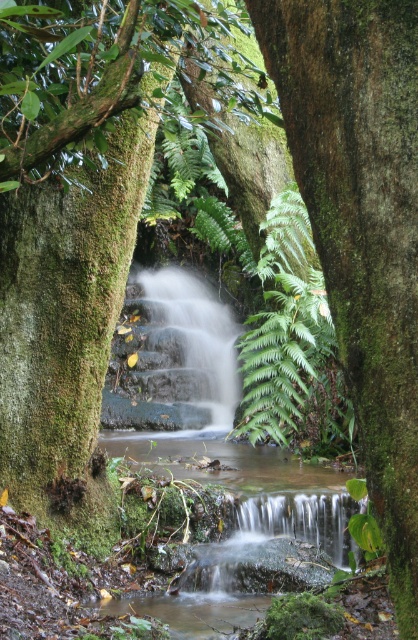
Question: Which of the following is the closest to the observer?

Choices:
 (A) green leafy fern at center
 (B) green mossy tree trunk at center

Answer: (B)

Question: Is green mossy tree trunk at center above green leafy fern at center?

Choices:
 (A) no
 (B) yes

Answer: (A)

Question: Is green mossy tree trunk at center below green leafy fern at center?

Choices:
 (A) no
 (B) yes

Answer: (B)

Question: Which object appears closest to the camera in this image?

Choices:
 (A) green mossy tree trunk at center
 (B) green leafy fern at center

Answer: (A)

Question: Is green mossy tree trunk at center closer to the viewer compared to green leafy fern at center?

Choices:
 (A) yes
 (B) no

Answer: (A)